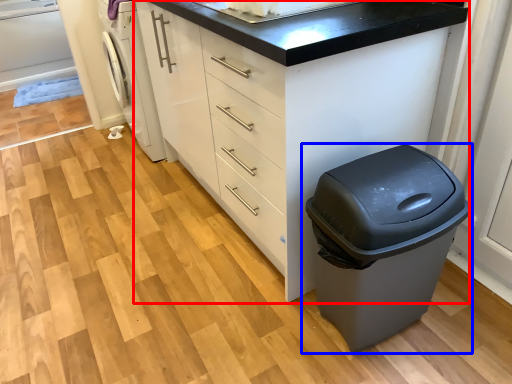
Question: Which point is further to the camera, chest of drawers (highlighted by a red box) or waste container (highlighted by a blue box)?

Choices:
 (A) chest of drawers
 (B) waste container

Answer: (A)